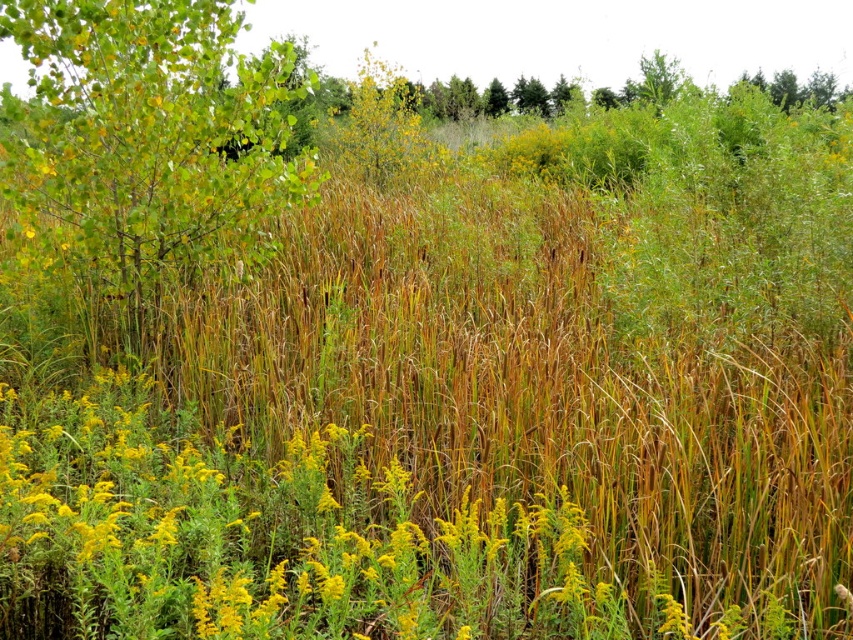
Question: Is yellow-green grass at center to the left of green leafy tree at upper left from the viewer's perspective?

Choices:
 (A) no
 (B) yes

Answer: (A)

Question: Is yellow-green grass at center to the left of green leafy tree at upper left from the viewer's perspective?

Choices:
 (A) yes
 (B) no

Answer: (B)

Question: Which object appears closest to the camera in this image?

Choices:
 (A) green leafy tree at upper left
 (B) yellow-green grass at center

Answer: (B)

Question: Does yellow-green grass at center appear on the right side of green leafy tree at upper left?

Choices:
 (A) no
 (B) yes

Answer: (B)

Question: Which of the following is the farthest from the observer?

Choices:
 (A) 412,573
 (B) 54,60

Answer: (B)